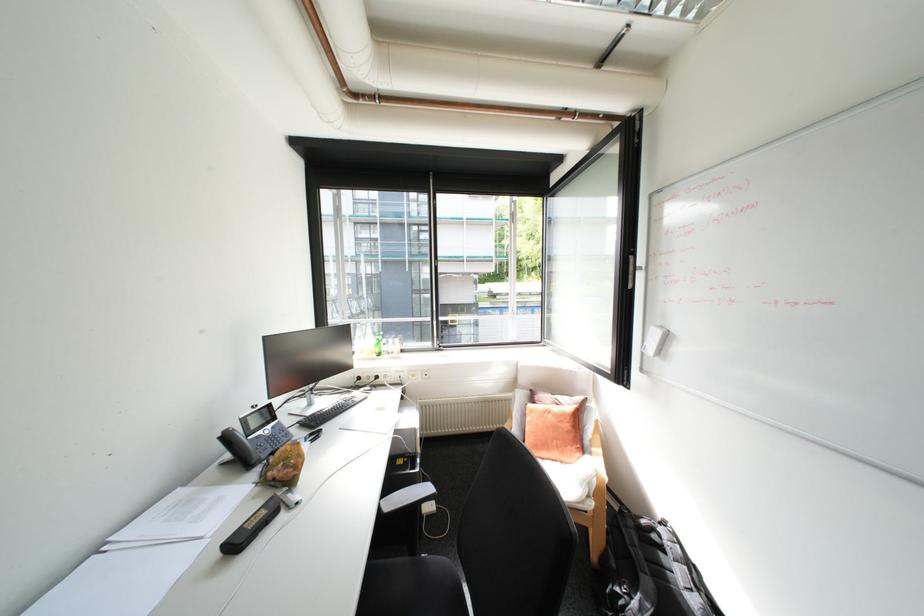
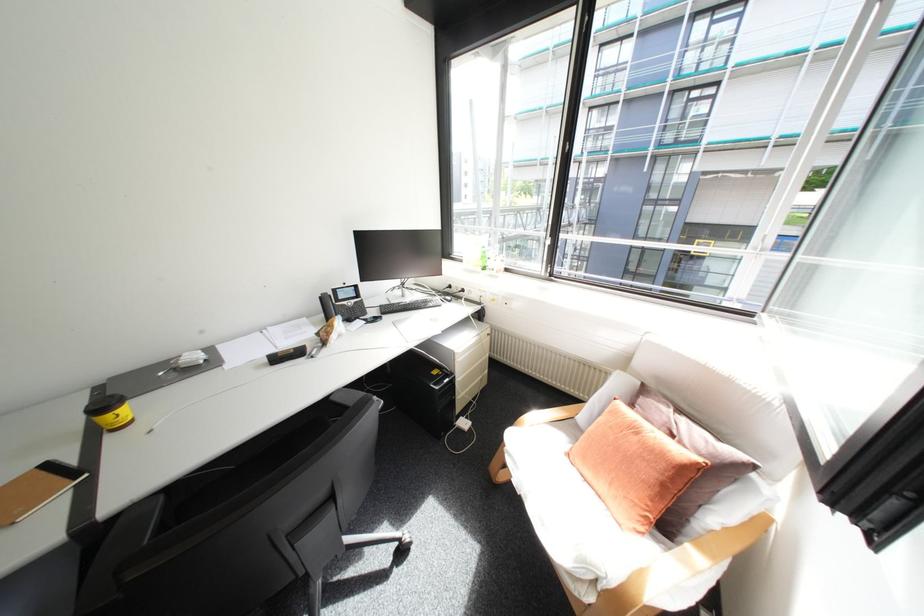
Locate, in the second image, the point that corresponds to [228,556] in the first image.

(275, 361)